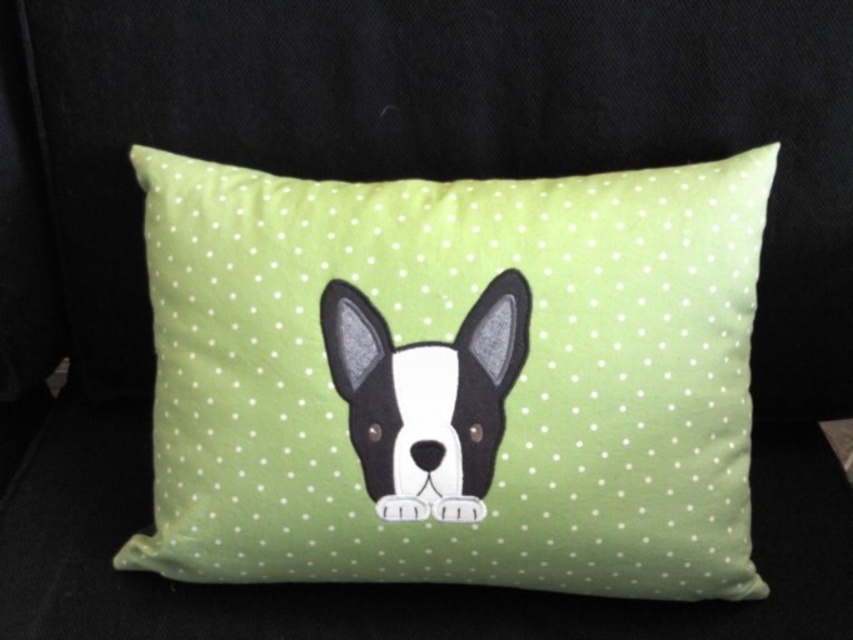
Does lime green fabric pillow with polka dots at center have a lesser height compared to black felt dog at center?

In fact, lime green fabric pillow with polka dots at center may be taller than black felt dog at center.

Between lime green fabric pillow with polka dots at center and black felt dog at center, which one is positioned higher?

lime green fabric pillow with polka dots at center is higher up.

Does point (563, 566) lie in front of point (508, 388)?

No, (563, 566) is further to viewer.

This screenshot has width=853, height=640. What are the coordinates of `lime green fabric pillow with polka dots at center` in the screenshot? It's located at (454, 378).